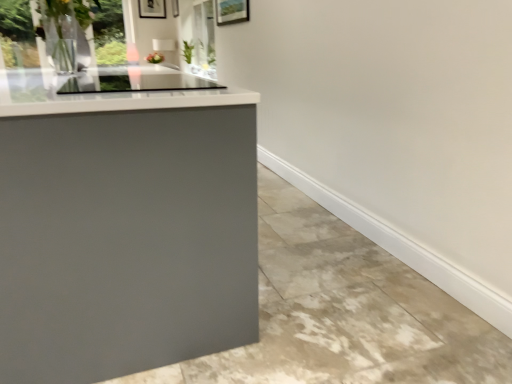
Question: From the image's perspective, is matte gray concrete at lower left beneath transparent glass window at upper left?

Choices:
 (A) yes
 (B) no

Answer: (A)

Question: Can you confirm if matte gray concrete at lower left is positioned to the right of transparent glass window at upper left?

Choices:
 (A) no
 (B) yes

Answer: (B)

Question: Could you tell me if matte gray concrete at lower left is facing transparent glass window at upper left?

Choices:
 (A) yes
 (B) no

Answer: (B)

Question: Does matte gray concrete at lower left have a lesser width compared to transparent glass window at upper left?

Choices:
 (A) yes
 (B) no

Answer: (B)

Question: Can you confirm if matte gray concrete at lower left is positioned to the left of transparent glass window at upper left?

Choices:
 (A) no
 (B) yes

Answer: (A)

Question: Visually, is matte gray concrete at lower left positioned to the left or to the right of transparent glass window at upper left?

Choices:
 (A) left
 (B) right

Answer: (B)

Question: From a real-world perspective, is matte gray concrete at lower left physically located above or below transparent glass window at upper left?

Choices:
 (A) below
 (B) above

Answer: (A)

Question: In terms of width, does matte gray concrete at lower left look wider or thinner when compared to transparent glass window at upper left?

Choices:
 (A) thin
 (B) wide

Answer: (B)

Question: Considering their positions, is matte gray concrete at lower left located in front of or behind transparent glass window at upper left?

Choices:
 (A) front
 (B) behind

Answer: (A)

Question: From the image's perspective, is matte black picture frame at upper center, the first picture frame when ordered from left to right, above or below metallic silver picture frame at upper center, the 1th picture frame when ordered from right to left?

Choices:
 (A) above
 (B) below

Answer: (A)

Question: Is point (163, 8) closer or farther from the camera than point (173, 14)?

Choices:
 (A) closer
 (B) farther

Answer: (A)

Question: Is matte black picture frame at upper center, the first picture frame when ordered from left to right, bigger or smaller than metallic silver picture frame at upper center, the 1th picture frame when ordered from right to left?

Choices:
 (A) big
 (B) small

Answer: (B)

Question: Considering their positions, is matte black picture frame at upper center, the first picture frame when ordered from left to right, located in front of or behind metallic silver picture frame at upper center, the 1th picture frame when ordered from right to left?

Choices:
 (A) front
 (B) behind

Answer: (B)

Question: Is point (352, 347) closer or farther from the camera than point (177, 13)?

Choices:
 (A) closer
 (B) farther

Answer: (A)

Question: Looking at their shapes, would you say matte gray concrete at lower left is wider or thinner than metallic silver picture frame at upper center, the 1th picture frame when ordered from right to left?

Choices:
 (A) wide
 (B) thin

Answer: (A)